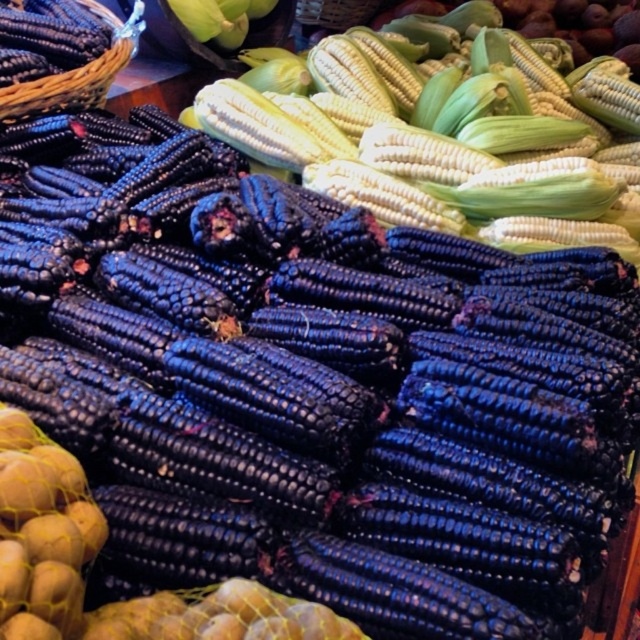
Question: Does blue matte corn at center have a smaller size compared to woven brown basket at upper left?

Choices:
 (A) no
 (B) yes

Answer: (A)

Question: Among these objects, which one is nearest to the camera?

Choices:
 (A) woven brown basket at upper left
 (B) blue matte corn at center

Answer: (A)

Question: Does blue matte corn at center have a smaller size compared to woven brown basket at upper left?

Choices:
 (A) no
 (B) yes

Answer: (A)

Question: Does blue matte corn at center have a greater width compared to woven brown basket at upper left?

Choices:
 (A) no
 (B) yes

Answer: (B)